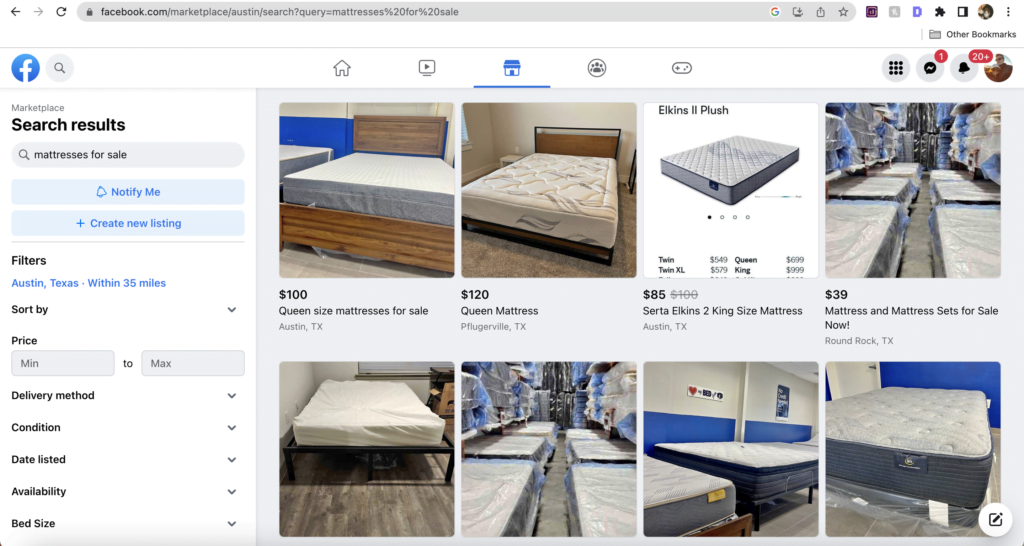
I want to click on walls, so click(x=319, y=130), click(x=512, y=118), click(x=486, y=123), click(x=939, y=371), click(x=689, y=416), click(x=338, y=367), click(x=292, y=385).